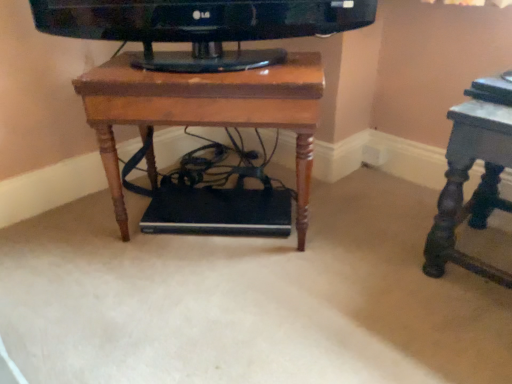
Where is `vacant area situated to the left side of wooden table at center, arranged as the 2th table when viewed from the right`? The height and width of the screenshot is (384, 512). vacant area situated to the left side of wooden table at center, arranged as the 2th table when viewed from the right is located at coordinates (72, 237).